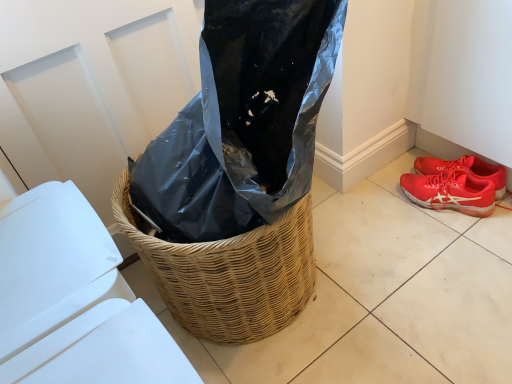
Identify the location of free space to the left of shiny red sneakers at lower right, acting as the 2th footwear starting from the top. (387, 226).